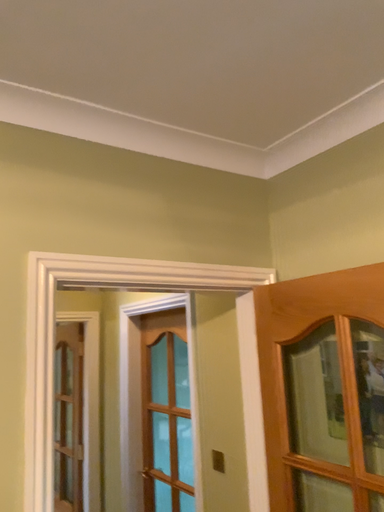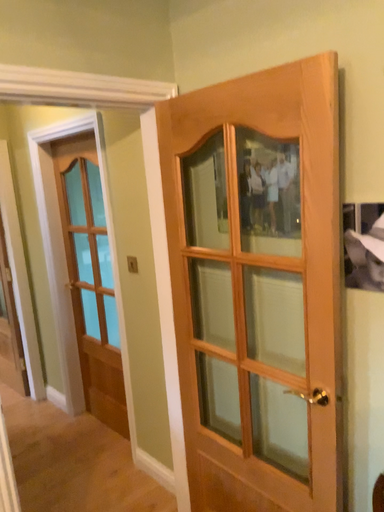
Question: Which way did the camera rotate in the video?

Choices:
 (A) rotated downward
 (B) rotated upward

Answer: (A)